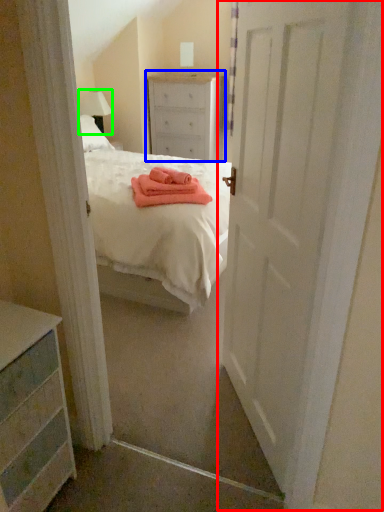
Question: Based on their relative distances, which object is farther from door (highlighted by a red box)? Choose from chest of drawers (highlighted by a blue box) and lamp (highlighted by a green box).

Choices:
 (A) chest of drawers
 (B) lamp

Answer: (B)